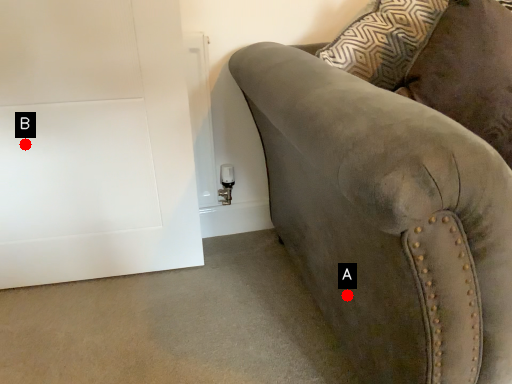
Question: Two points are circled on the image, labeled by A and B beside each circle. Which point is closer to the camera?

Choices:
 (A) A is closer
 (B) B is closer

Answer: (A)